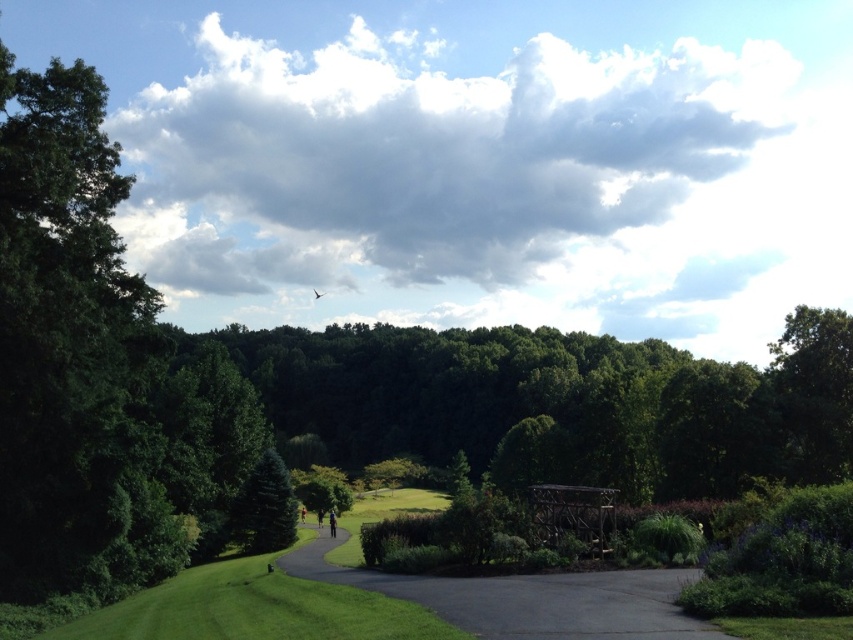
Question: Does dark asphalt path at center appear on the right side of dark blue jeans at center?

Choices:
 (A) yes
 (B) no

Answer: (A)

Question: Among these objects, which one is farthest from the camera?

Choices:
 (A) dark blue jeans at center
 (B) green leafy tree at right
 (C) green matte tree at center-left

Answer: (B)

Question: Which point appears closest to the camera in this image?

Choices:
 (A) (822, 451)
 (B) (318, 525)
 (C) (303, 508)

Answer: (A)

Question: Is green leafy tree at upper left bigger than dark blue jeans at center?

Choices:
 (A) yes
 (B) no

Answer: (A)

Question: Which object appears farthest from the camera in this image?

Choices:
 (A) black fabric person at center
 (B) green fabric person at center

Answer: (A)

Question: Can you confirm if dark asphalt path at center is positioned to the right of green fabric person at center?

Choices:
 (A) yes
 (B) no

Answer: (A)